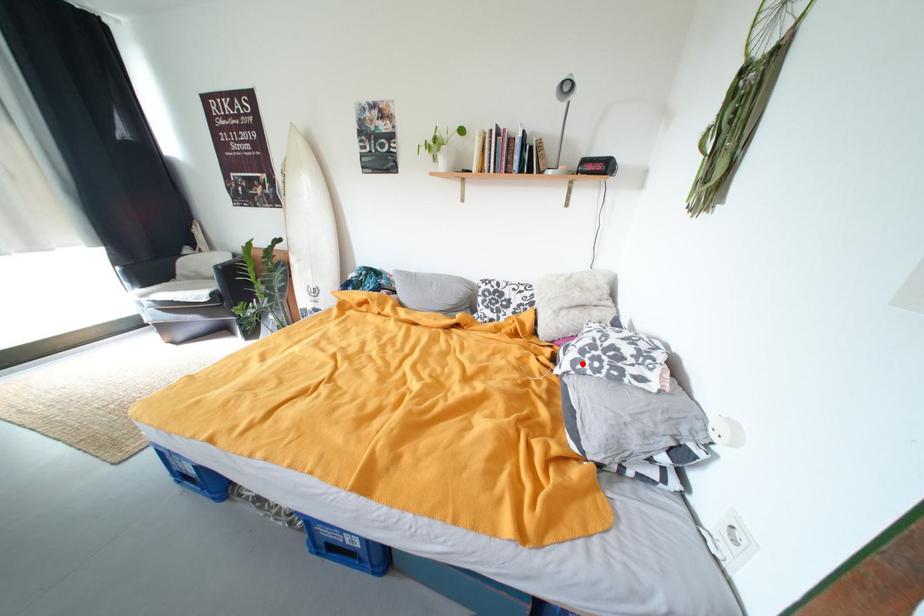
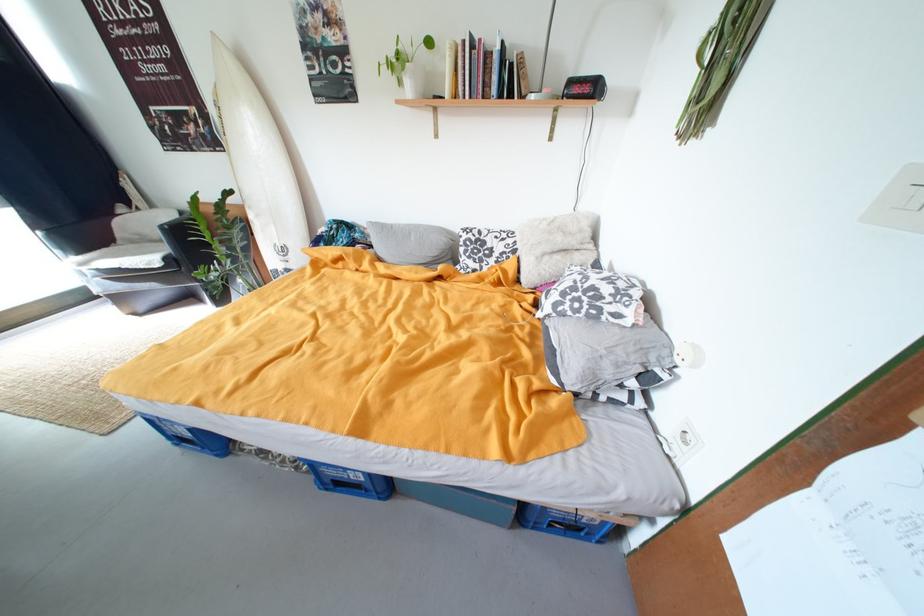
In the second image, find the point that corresponds to the highlighted location in the first image.

(564, 306)